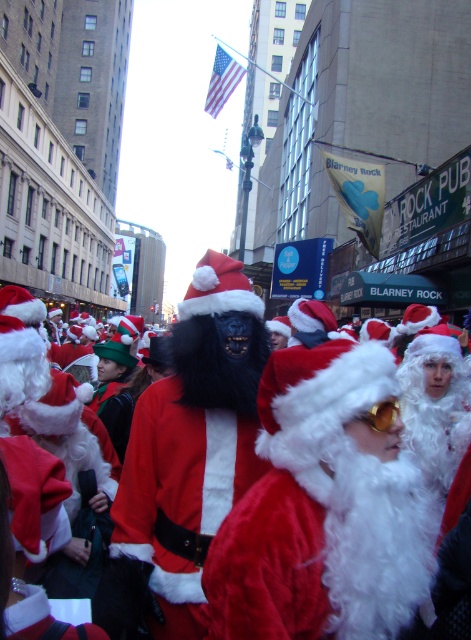
You are a photographer trying to capture both the velvet red santa claus at center and the fuzzy red santa at center in a single shot. Which of the two Santas should you focus on first if you want to ensure both are in frame without moving the camera?

The velvet red santa claus at center is not as tall as the fuzzy red santa at center, so you should focus on the taller fuzzy red santa at center first to ensure the shorter one is also in frame.

You are a photographer trying to capture both the velvet santa costume at center and the fuzzy red santa at center in a single frame. Given their height difference, which one should you adjust your camera angle to focus on first to ensure both are visible?

The velvet santa costume at center is shorter than the fuzzy red santa at center. To ensure both are visible, adjust the camera angle to focus on the velvet santa costume at center first, then adjust to include the taller fuzzy red santa at center.

Looking at this image, you are organizing a Christmas parade and need to decide which Santa costume to use. The velvet santa costume at center and the fuzzy red santa at center are both available. Based on their sizes, which one would be more suitable for a float that requires a larger, more prominent display?

The velvet santa costume at center is bigger than the fuzzy red santa at center, so it would be more suitable for a float requiring a larger, more prominent display.